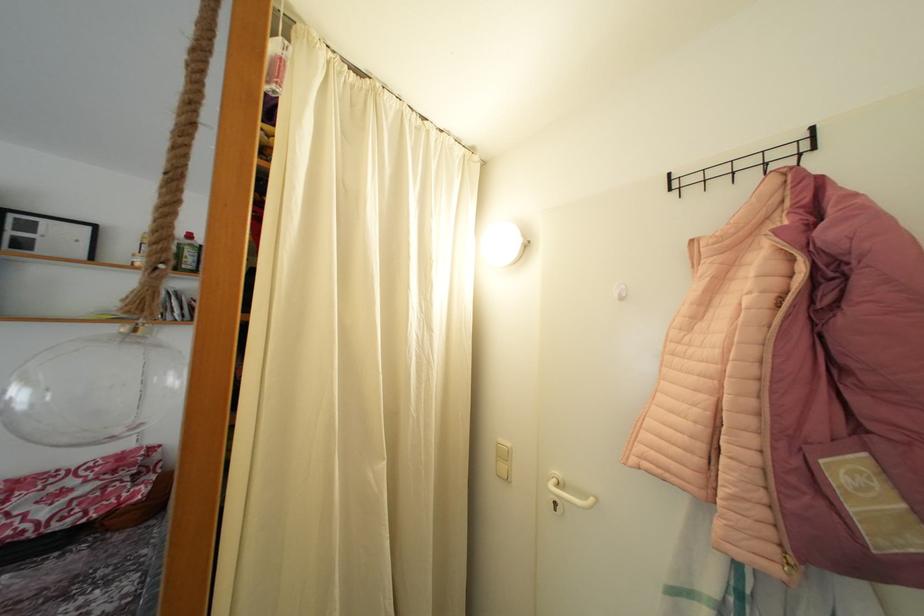
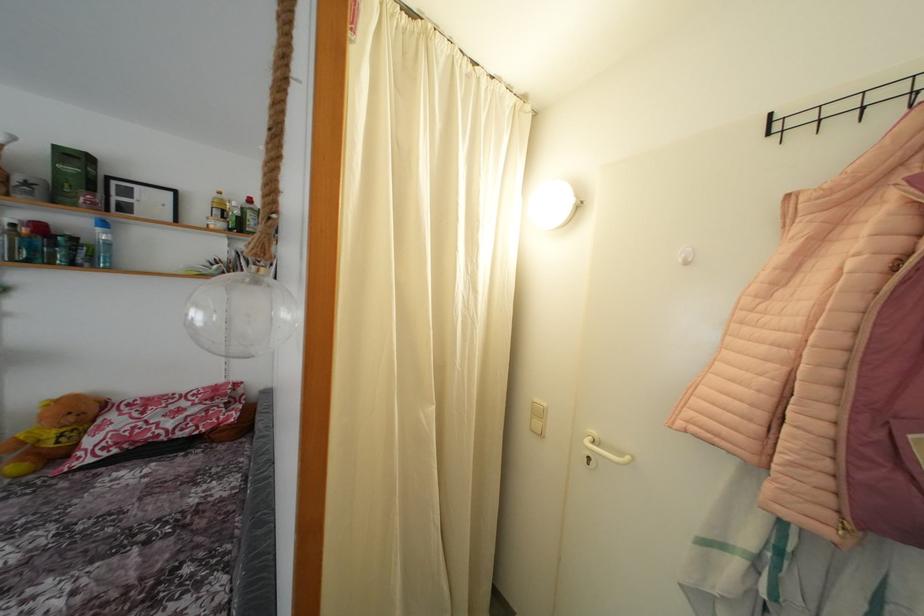
Where in the second image is the point corresponding to point 561,509 from the first image?

(593, 464)